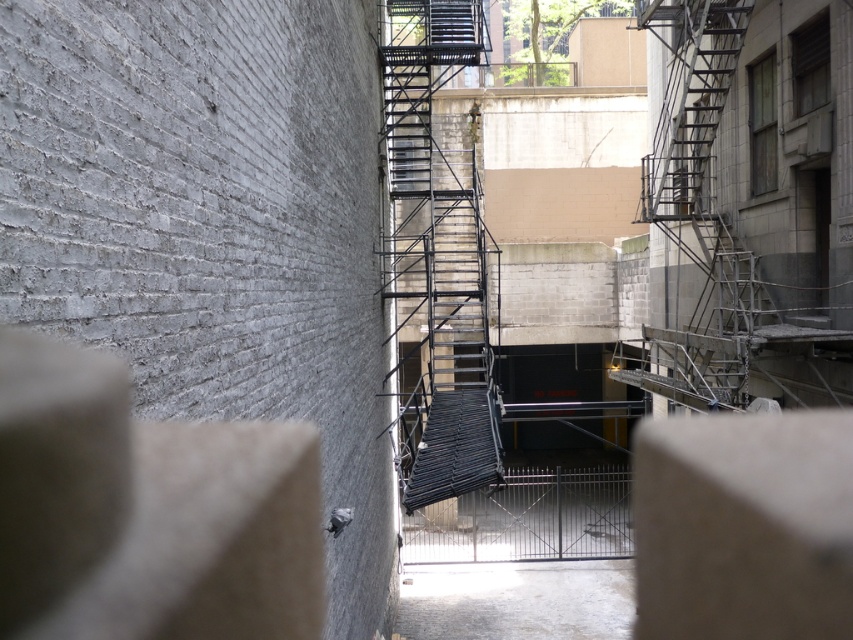
You are a painter who needs to paint the metallic gray fire escape at center and the metallic black staircase at center. Since you can only paint one at a time, which one should you paint first based on their positions in the alleyway?

You should paint the metallic gray fire escape at center first because the metallic black staircase at center is behind it, making the fire escape more accessible to paint first.

You are standing in the alleyway and need to locate the black metal fire escape at center. According to the coordinates provided, where exactly is it positioned?

The black metal fire escape at center is located at point coordinates 0.403 on the x axis and 0.512 on the y axis.

You are a painter who needs to place a 1.2 meter wide canvas between the black metal fire escape at center and the metallic black staircase at center. Based on the scene, will the canvas fit between them?

The black metal fire escape at center is wider than the metallic black staircase at center. Therefore, the total space between them may not be sufficient to accommodate a 1.2 meter wide canvas. It is recommended to measure the exact distance before placing the canvas.